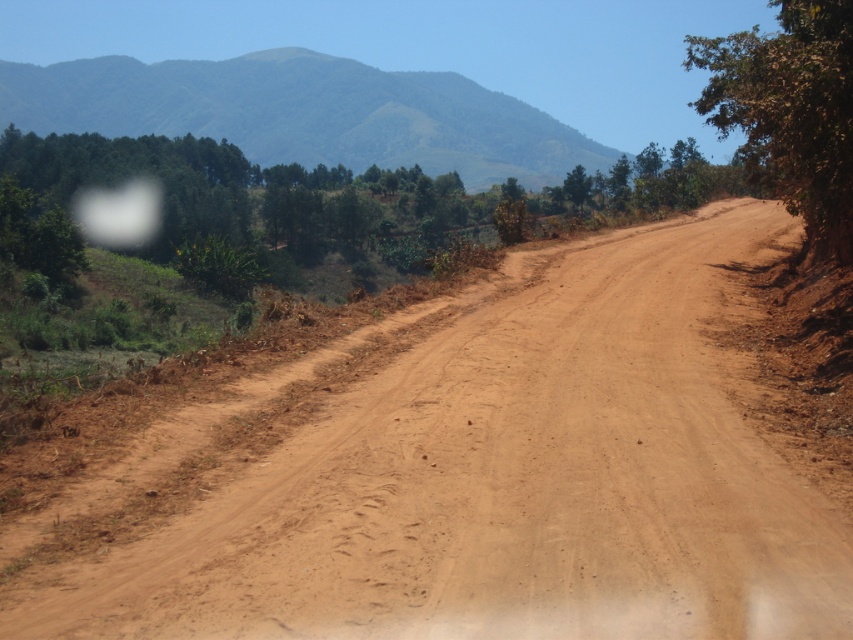
Question: Which object is closer to the camera taking this photo?

Choices:
 (A) brown rough tree at right
 (B) green textured hill at upper center

Answer: (A)

Question: Among these objects, which one is farthest from the camera?

Choices:
 (A) green textured hill at upper center
 (B) brown dirt road at center

Answer: (A)

Question: Based on their relative distances, which object is nearer to the green textured hill at upper center?

Choices:
 (A) brown dirt road at center
 (B) brown rough tree at right

Answer: (B)

Question: In this image, where is green textured hill at upper center located relative to brown rough tree at right?

Choices:
 (A) below
 (B) above

Answer: (B)

Question: Can you confirm if brown dirt road at center is positioned below brown rough tree at right?

Choices:
 (A) no
 (B) yes

Answer: (B)

Question: In this image, where is brown dirt road at center located relative to green textured hill at upper center?

Choices:
 (A) above
 (B) below

Answer: (B)